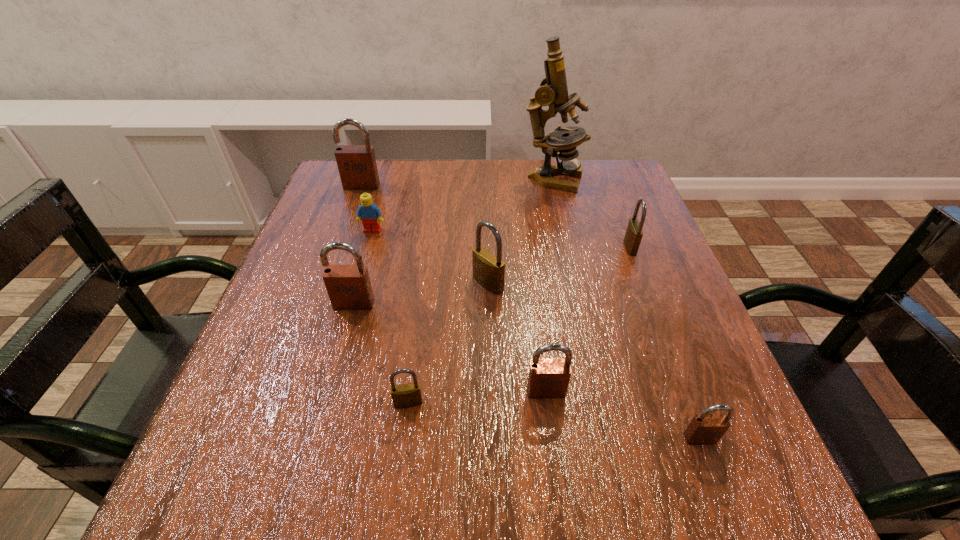
Identify the location of the third padlock from right to left. (548, 378).

Image resolution: width=960 pixels, height=540 pixels. I want to click on Lego, so click(x=368, y=212).

Image resolution: width=960 pixels, height=540 pixels. In order to click on the third farthest object in this screenshot , I will do `click(368, 212)`.

Find the location of a particular element. Image resolution: width=960 pixels, height=540 pixels. the smallest brass padlock is located at coordinates (407, 395).

Find the location of a particular element. The image size is (960, 540). the sixth object from right to left is located at coordinates (407, 395).

What are the coordinates of `the nearest padlock` in the screenshot? It's located at (704, 428).

You are a GUI agent. You are given a task and a screenshot of the screen. Output one action in this format:
    pyautogui.click(x=<x>, y=<y>)
    Task: Click on the nearest brown padlock
    The width and height of the screenshot is (960, 540).
    Given the screenshot: What is the action you would take?
    pyautogui.click(x=704, y=428)

The image size is (960, 540). I want to click on vacant space situated 0.240m on the front of the tallest object, so click(570, 256).

Find the location of a particular element. The height and width of the screenshot is (540, 960). vacant region located 0.360m on the front-facing side of the biggest brown padlock is located at coordinates (324, 292).

At what (x,y) coordinates should I click in order to perform the action: click on free spot located on the right of the second farthest brass padlock. Please return your answer as a coordinate pair (x, y). Looking at the image, I should click on (660, 284).